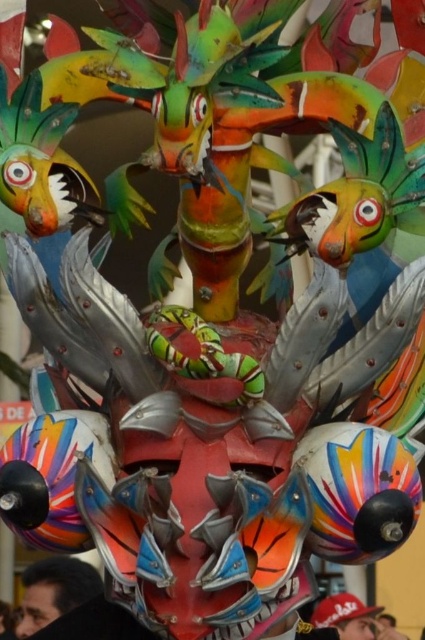
Question: Estimate the real-world distances between objects in this image. Which object is farther from the matte red baseball cap at lower center?

Choices:
 (A) metallic red mask at center
 (B) matte black head at lower left

Answer: (A)

Question: Is matte black head at lower left wider than metallic red mask at center?

Choices:
 (A) no
 (B) yes

Answer: (B)

Question: Based on their relative distances, which object is farther from the matte red baseball cap at lower center?

Choices:
 (A) metallic red mask at center
 (B) matte black head at lower left

Answer: (A)

Question: Which point is farther to the camera?

Choices:
 (A) matte black head at lower left
 (B) matte red baseball cap at lower center
 (C) metallic red mask at center

Answer: (C)

Question: Is matte red baseball cap at lower center to the left of metallic red mask at center from the viewer's perspective?

Choices:
 (A) yes
 (B) no

Answer: (B)

Question: Is matte red baseball cap at lower center positioned in front of metallic red mask at center?

Choices:
 (A) no
 (B) yes

Answer: (B)